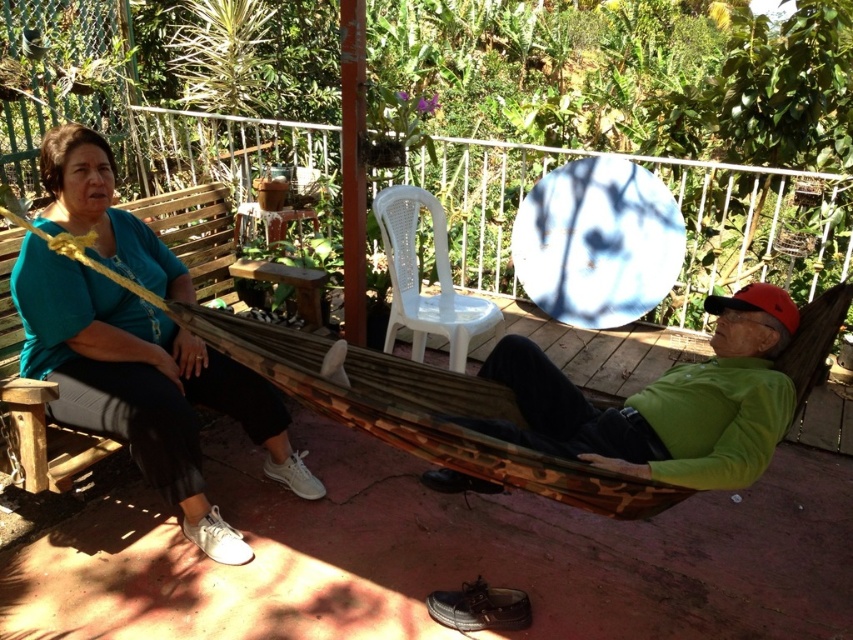
Question: Is green matte shirt at right smaller than wooden bench at left?

Choices:
 (A) no
 (B) yes

Answer: (A)

Question: Which point appears farthest from the camera in this image?

Choices:
 (A) (28, 490)
 (B) (532, 344)

Answer: (B)

Question: Which is farther from the white plastic chair at center?

Choices:
 (A) green matte shirt at right
 (B) wooden bench at left
 (C) teal fabric shirt at upper left
 (D) camouflage fabric hammock at center

Answer: (B)

Question: Is white plastic chair at center to the left of wooden bench at left from the viewer's perspective?

Choices:
 (A) yes
 (B) no

Answer: (B)

Question: Based on their relative distances, which object is farther from the green matte shirt at right?

Choices:
 (A) wooden bench at left
 (B) teal fabric shirt at upper left

Answer: (A)

Question: Is camouflage fabric hammock at center behind white plastic chair at center?

Choices:
 (A) yes
 (B) no

Answer: (B)